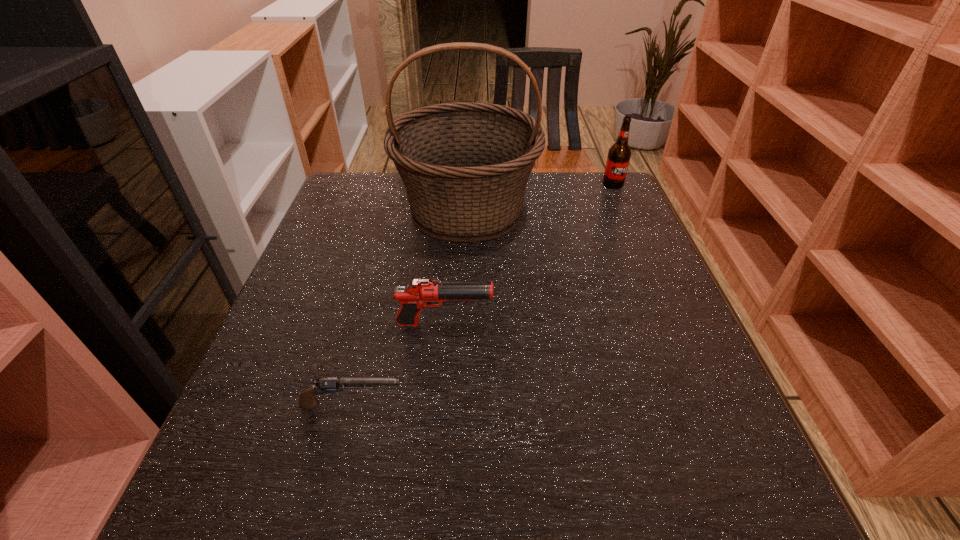
Locate an element on the screen. The image size is (960, 540). free location that satisfies the following two spatial constraints: 1. on the front side of the root beer; 2. at the aiming end of the third tallest object is located at coordinates (674, 324).

You are a GUI agent. You are given a task and a screenshot of the screen. Output one action in this format:
    pyautogui.click(x=<x>, y=<y>)
    Task: Click on the free space that satisfies the following two spatial constraints: 1. on the front side of the tallest object; 2. at the aiming end of the farther gun
    
    Given the screenshot: What is the action you would take?
    [462, 324]